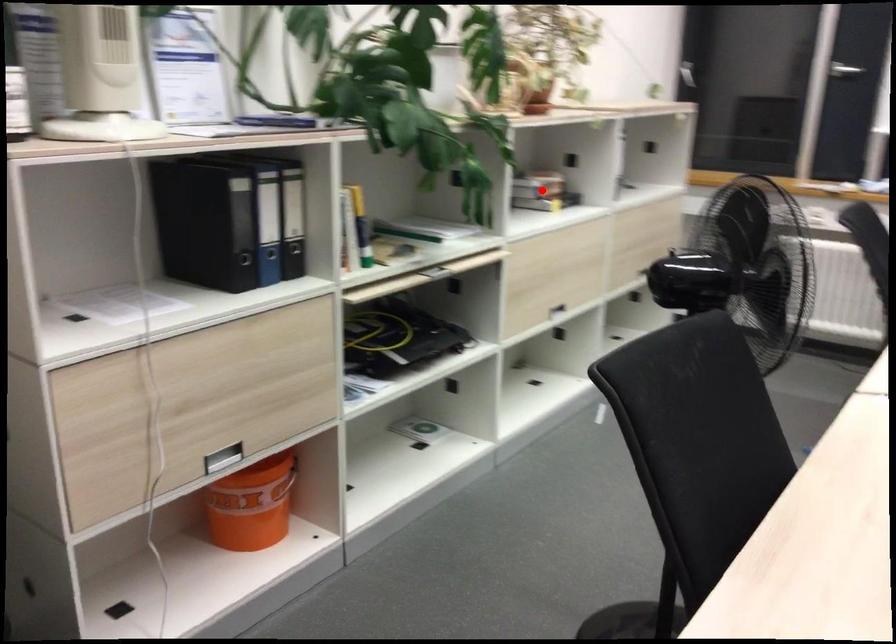
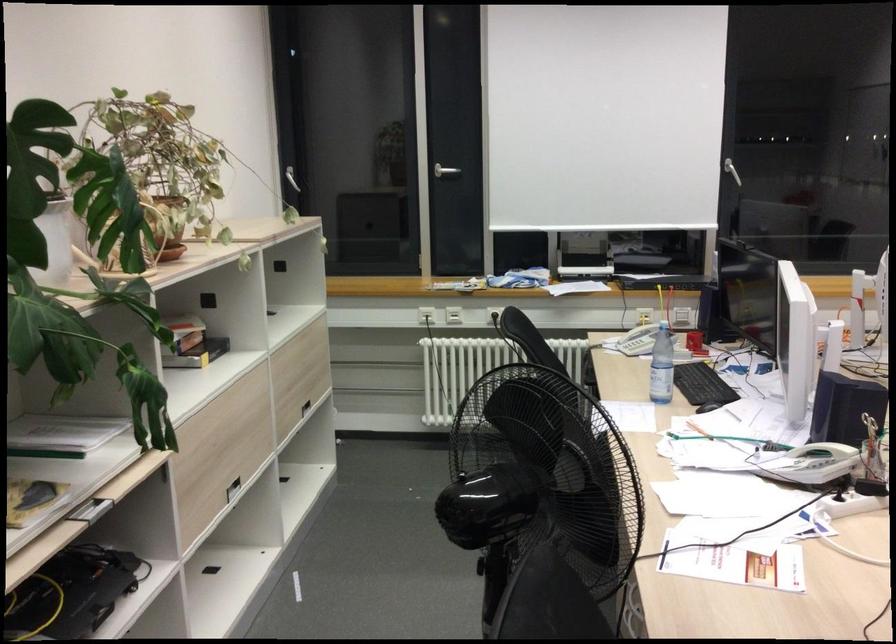
Question: I am providing you with two images of the same scene from different viewpoints. Image1 has a red point marked. In image2, the corresponding 3D location appears at what relative position? Reply with the corresponding letter.

Choices:
 (A) Closer
 (B) Farther

Answer: (A)